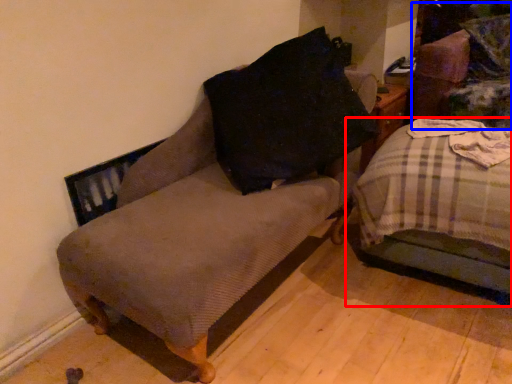
Question: Which object appears closest to the camera in this image, studio couch (highlighted by a red box) or swivel chair (highlighted by a blue box)?

Choices:
 (A) studio couch
 (B) swivel chair

Answer: (A)